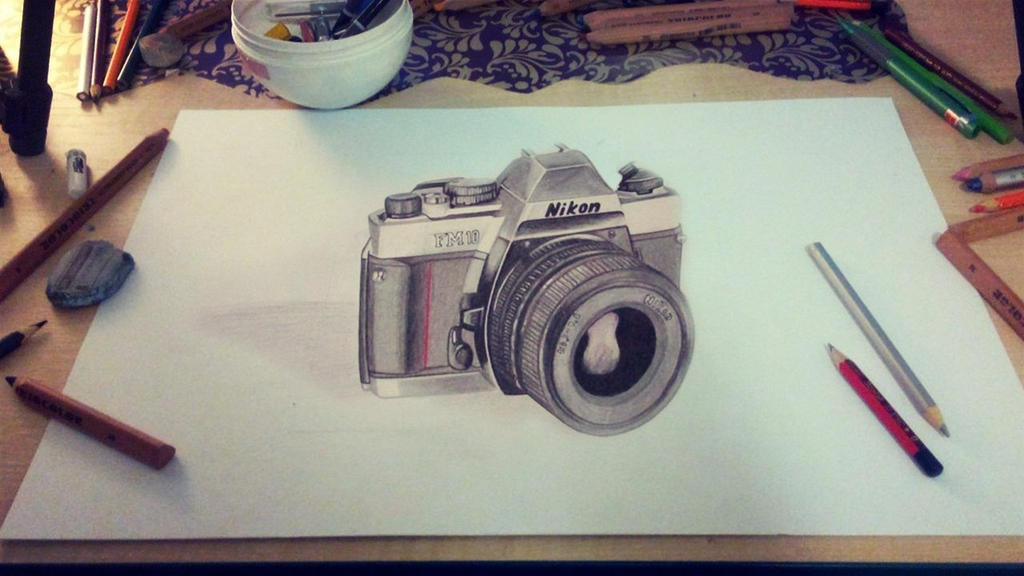
At what (x,y) coordinates should I click in order to perform the action: click on bowl. Please return your answer as a coordinate pair (x, y). Image resolution: width=1024 pixels, height=576 pixels. Looking at the image, I should click on (322, 92).